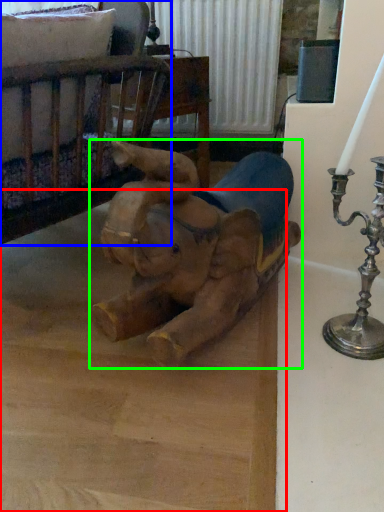
Question: Which object is the closest to the cardboard (highlighted by a red box)? Choose among these: furniture (highlighted by a blue box) or toy (highlighted by a green box).

Choices:
 (A) furniture
 (B) toy

Answer: (B)